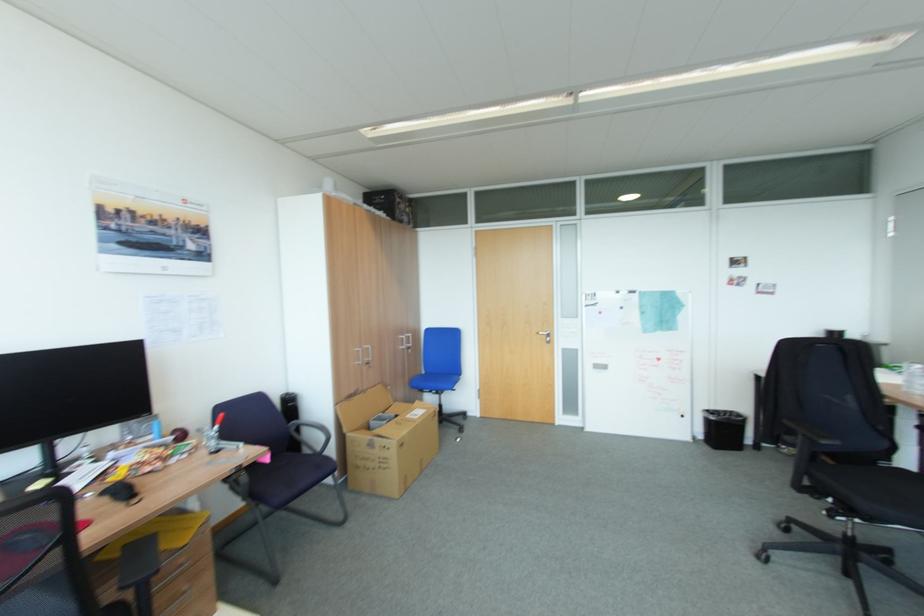
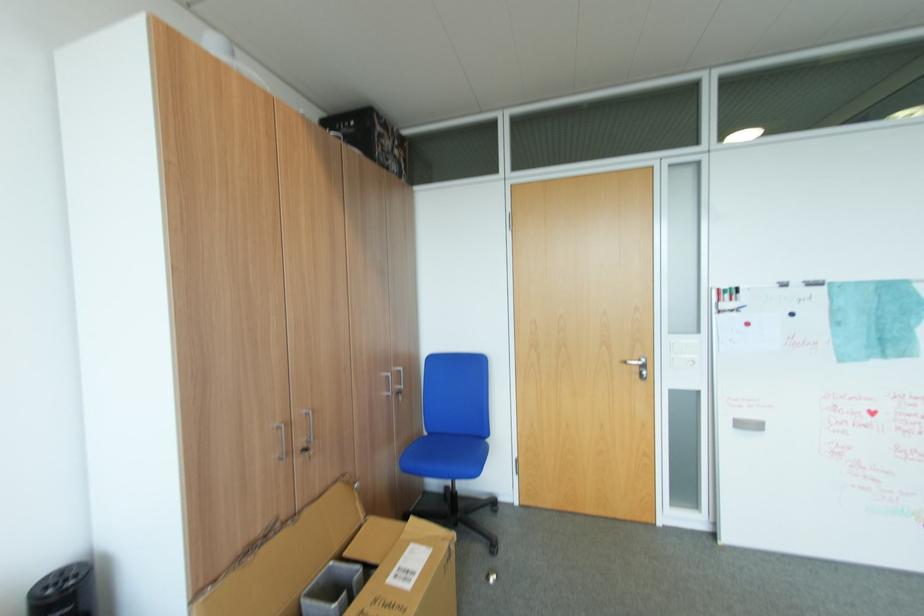
Find the pixel in the second image that matches (373,363) in the first image.

(310, 451)